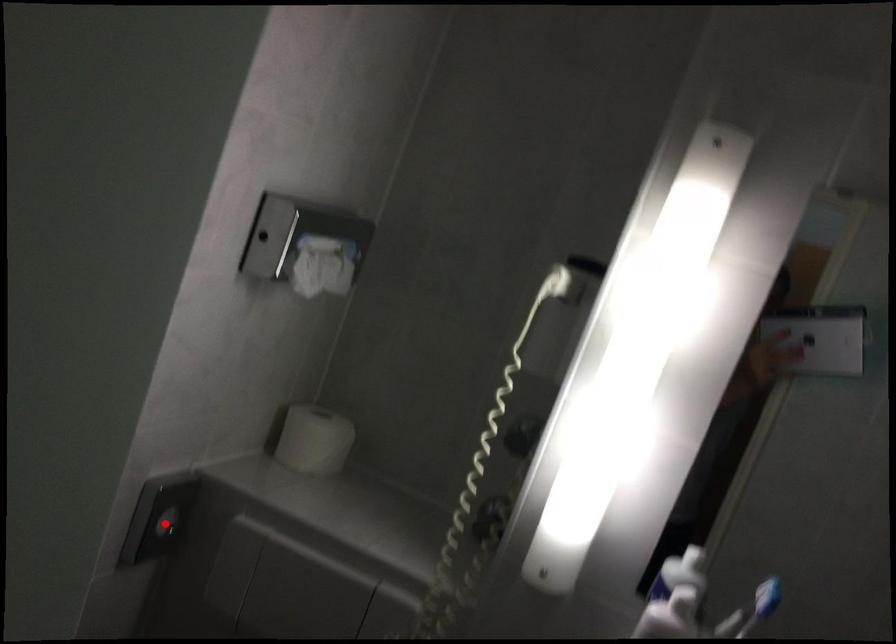
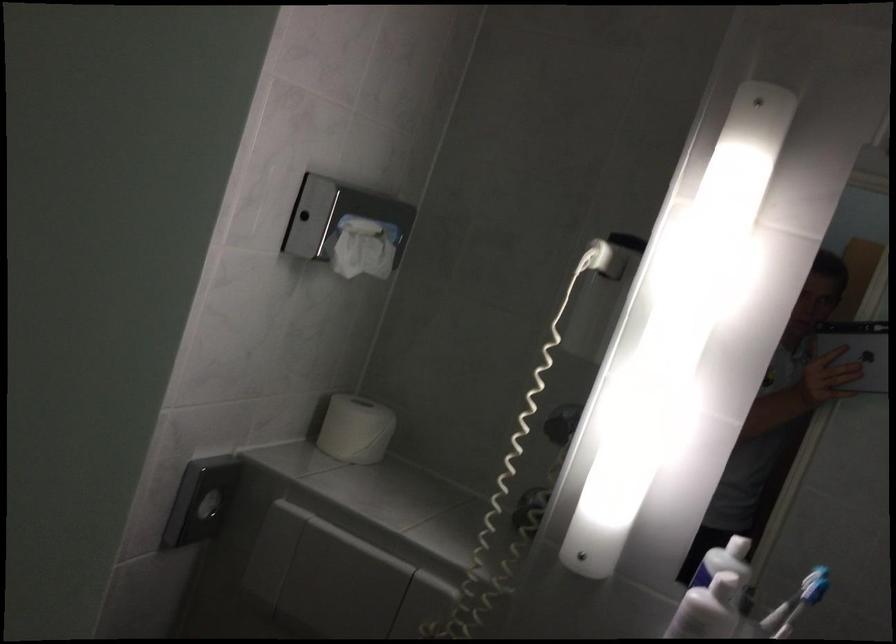
In the second image, find the point that corresponds to the highlighted location in the first image.

(208, 506)